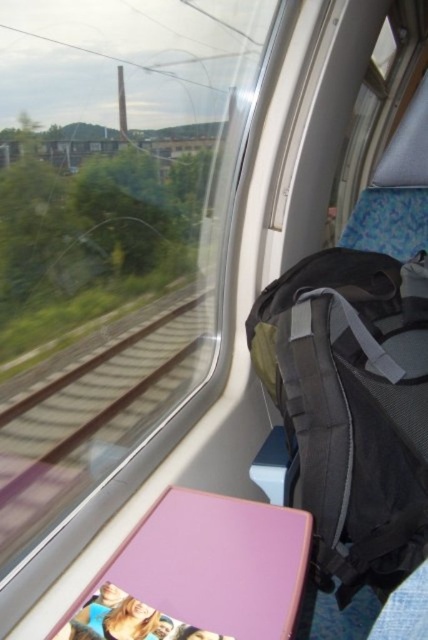
Question: Among these objects, which one is farthest from the camera?

Choices:
 (A) black fabric backpack at right
 (B) brown metal train track at left

Answer: (A)

Question: From the image, what is the correct spatial relationship of black fabric backpack at right in relation to brown metal train track at left?

Choices:
 (A) right
 (B) left

Answer: (A)

Question: Does black fabric backpack at right come in front of brown metal train track at left?

Choices:
 (A) yes
 (B) no

Answer: (B)

Question: Is black fabric backpack at right above brown metal train track at left?

Choices:
 (A) no
 (B) yes

Answer: (B)

Question: Among these objects, which one is nearest to the camera?

Choices:
 (A) black fabric backpack at right
 (B) brown metal train track at left

Answer: (B)